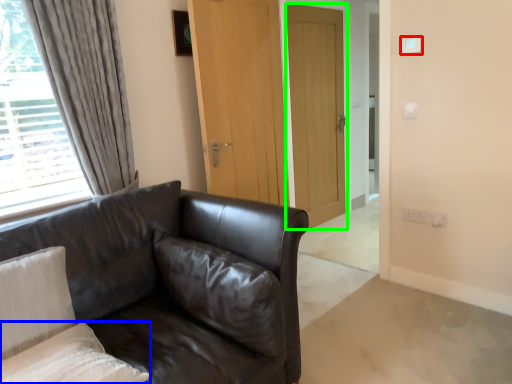
Question: Considering the real-world distances, which object is farthest from light switch (highlighted by a red box)? pillow (highlighted by a blue box) or door (highlighted by a green box)?

Choices:
 (A) pillow
 (B) door

Answer: (A)